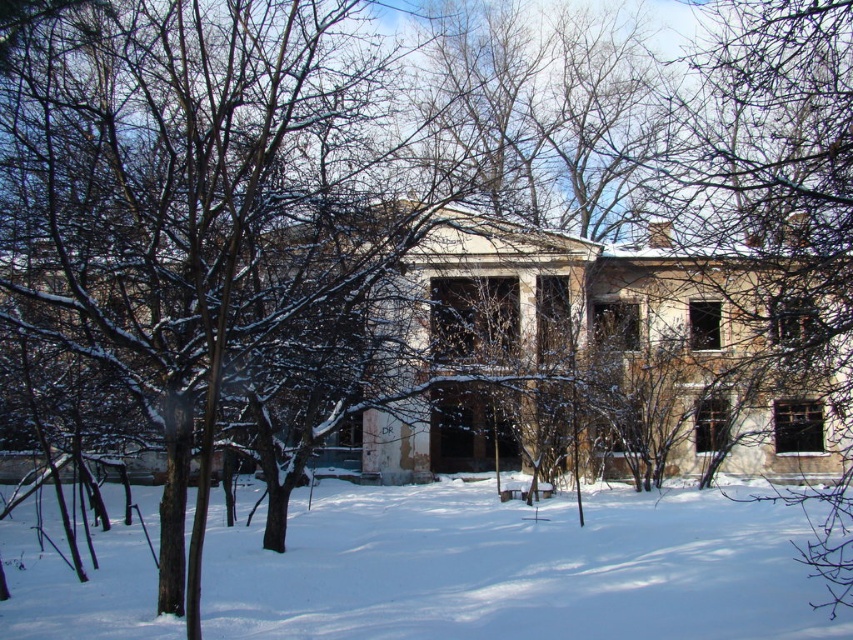
Which of these two, white powdery snow at center or brown bark tree at right, stands shorter?

white powdery snow at center is shorter.

Which is behind, point (672, 544) or point (816, 49)?

Point (672, 544)

Is point (286, 554) closer to viewer compared to point (682, 104)?

That is True.

Locate an element on the screen. The image size is (853, 640). white powdery snow at center is located at coordinates (514, 568).